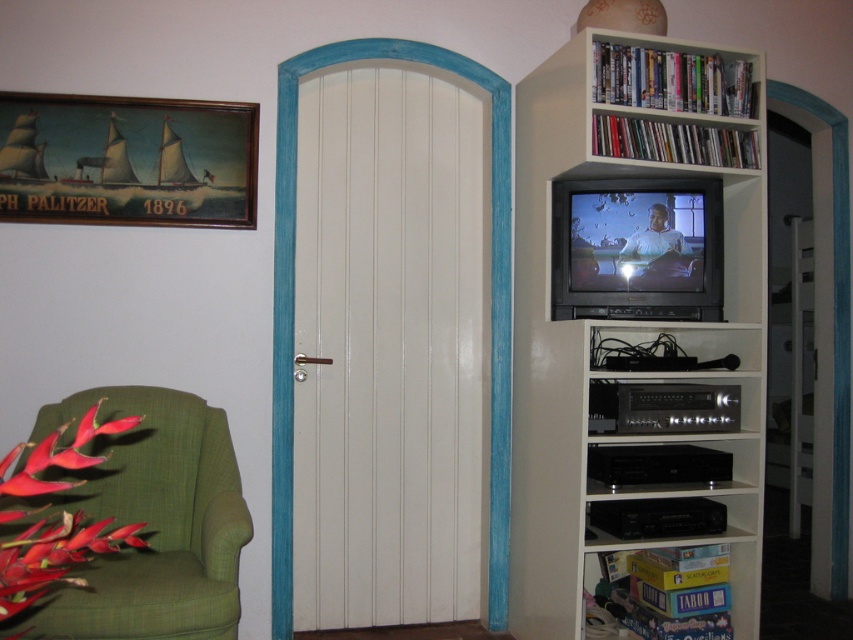
Who is more forward, [596,304] or [96,204]?

Point [596,304]

Who is more distant from viewer, (548, 436) or (238, 204)?

Positioned behind is point (238, 204).

Does point (547, 173) come in front of point (149, 140)?

Yes, point (547, 173) is closer to viewer.

Where is `white matte bookcase at upper right`? The width and height of the screenshot is (853, 640). white matte bookcase at upper right is located at coordinates (624, 339).

Is point (724, 449) more distant than point (151, 538)?

Yes.

Between point (572, 115) and point (113, 408), which one is positioned in front?

Point (113, 408) is in front.

Locate an element on the screen. The height and width of the screenshot is (640, 853). white matte bookcase at upper right is located at coordinates (624, 339).

Does green fabric armchair at left come in front of wooden framed painting at upper left?

That is True.

Does green fabric armchair at left lie behind wooden framed painting at upper left?

That is False.

At what (x,y) coordinates should I click in order to perform the action: click on green fabric armchair at left. Please return your answer as a coordinate pair (x, y). This screenshot has height=640, width=853. Looking at the image, I should click on (151, 520).